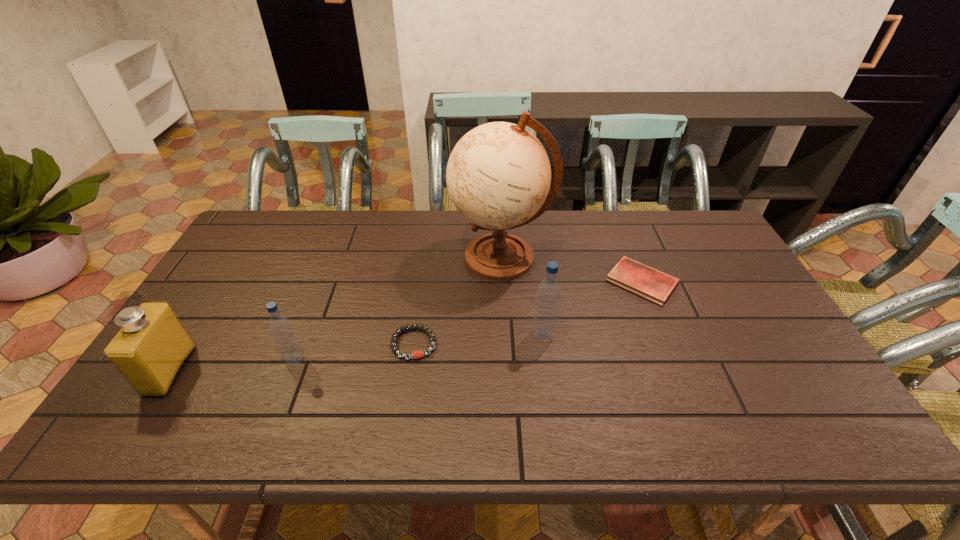
You are a GUI agent. You are given a task and a screenshot of the screen. Output one action in this format:
    pyautogui.click(x=<x>, y=<y>)
    Task: Click on the second object from left to right
    Image resolution: width=960 pixels, height=540 pixels.
    Given the screenshot: What is the action you would take?
    pyautogui.click(x=281, y=329)

Where is `the shorter water bottle`? The image size is (960, 540). the shorter water bottle is located at coordinates (281, 329).

Identify the location of the farther water bottle. (548, 296).

Where is `the taller water bottle`? This screenshot has width=960, height=540. the taller water bottle is located at coordinates (548, 296).

I want to click on the rightmost object, so click(x=649, y=283).

Where is `diary`? This screenshot has height=540, width=960. diary is located at coordinates (649, 283).

Locate an element on the screen. the tallest object is located at coordinates (498, 176).

Identify the location of the leftmost object. (151, 348).

This screenshot has height=540, width=960. What are the coordinates of `bracelet` in the screenshot? It's located at (416, 354).

You are a GUI agent. You are given a task and a screenshot of the screen. Output one action in this format:
    pyautogui.click(x=<x>, y=<y>)
    Task: Click on the free location located 0.400m on the back of the shorter water bottle
    This screenshot has height=540, width=960.
    Given the screenshot: What is the action you would take?
    pyautogui.click(x=335, y=255)